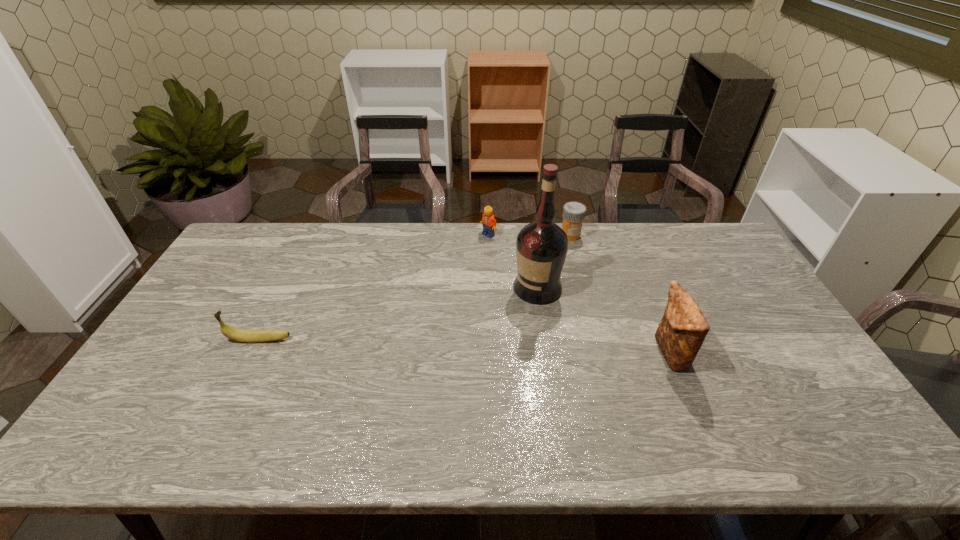
Identify the location of object that ranks as the third closest to the tallest object. This screenshot has height=540, width=960. (683, 328).